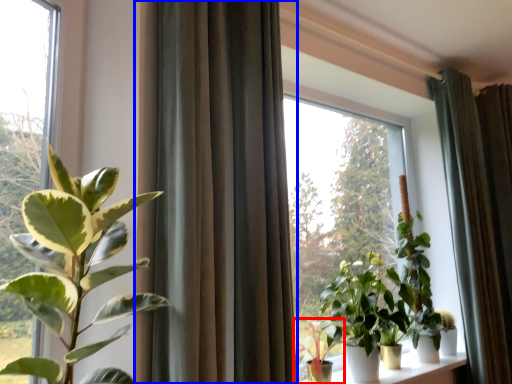
Question: Which object appears farthest to the camera in this image, houseplant (highlighted by a red box) or curtain (highlighted by a blue box)?

Choices:
 (A) houseplant
 (B) curtain

Answer: (A)